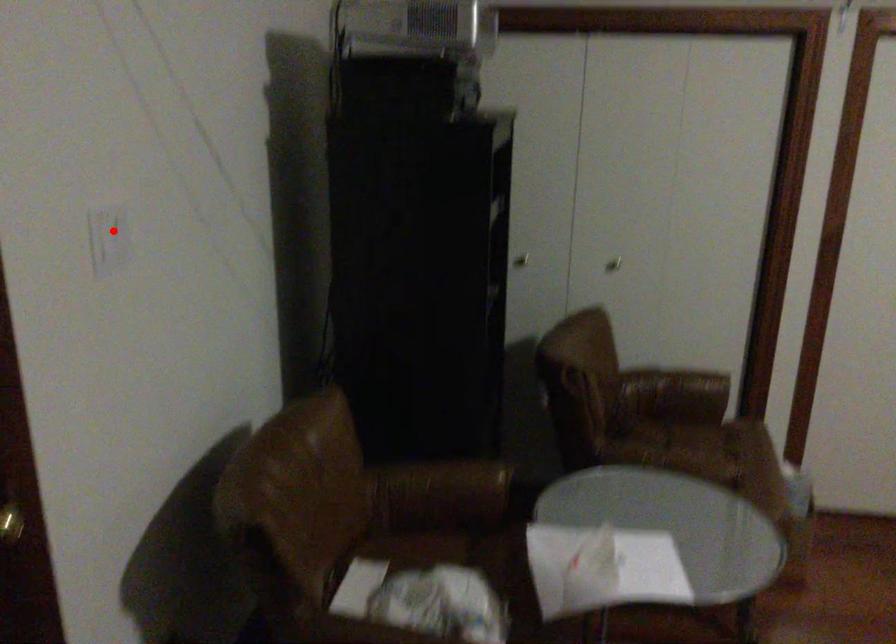
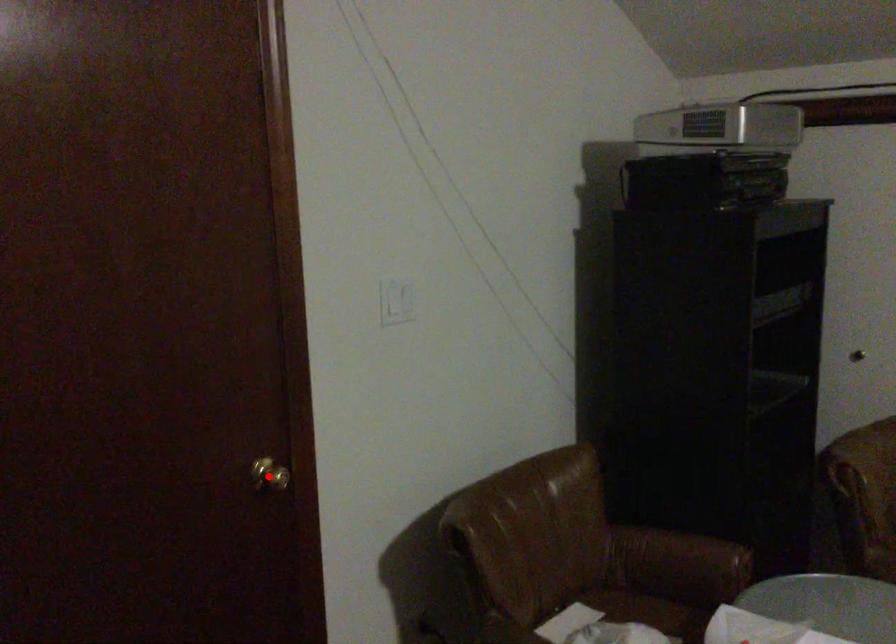
I am providing you with two images of the same scene from different viewpoints. A red point is marked on the first image and another point is marked on the second image. Are the points marked in image1 and image2 representing the same 3D position?

No